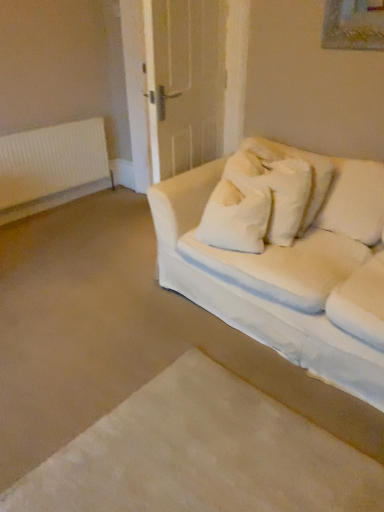
Question: Is white fabric couch at right next to white plastic radiator at left?

Choices:
 (A) yes
 (B) no

Answer: (B)

Question: Is white fabric couch at right positioned before white plastic radiator at left?

Choices:
 (A) yes
 (B) no

Answer: (A)

Question: Considering the relative sizes of white fabric couch at right and white plastic radiator at left in the image provided, is white fabric couch at right shorter than white plastic radiator at left?

Choices:
 (A) no
 (B) yes

Answer: (A)

Question: Does white fabric couch at right have a greater height compared to white plastic radiator at left?

Choices:
 (A) no
 (B) yes

Answer: (B)

Question: From the image's perspective, does white fabric couch at right appear higher than white plastic radiator at left?

Choices:
 (A) yes
 (B) no

Answer: (B)

Question: From a real-world perspective, is white fabric couch at right located beneath white plastic radiator at left?

Choices:
 (A) yes
 (B) no

Answer: (B)

Question: Does white fabric couch at right appear on the right side of white soft carpet at lower left?

Choices:
 (A) yes
 (B) no

Answer: (A)

Question: Is the depth of white fabric couch at right greater than that of white soft carpet at lower left?

Choices:
 (A) yes
 (B) no

Answer: (A)

Question: Is white fabric couch at right smaller than white soft carpet at lower left?

Choices:
 (A) no
 (B) yes

Answer: (A)

Question: Is white fabric couch at right placed right next to white soft carpet at lower left?

Choices:
 (A) yes
 (B) no

Answer: (B)

Question: From the image's perspective, is white fabric couch at right above white soft carpet at lower left?

Choices:
 (A) yes
 (B) no

Answer: (A)

Question: Is white fabric couch at right thinner than white soft carpet at lower left?

Choices:
 (A) yes
 (B) no

Answer: (A)

Question: From a real-world perspective, is white soft carpet at lower left below white fabric couch at right?

Choices:
 (A) no
 (B) yes

Answer: (B)